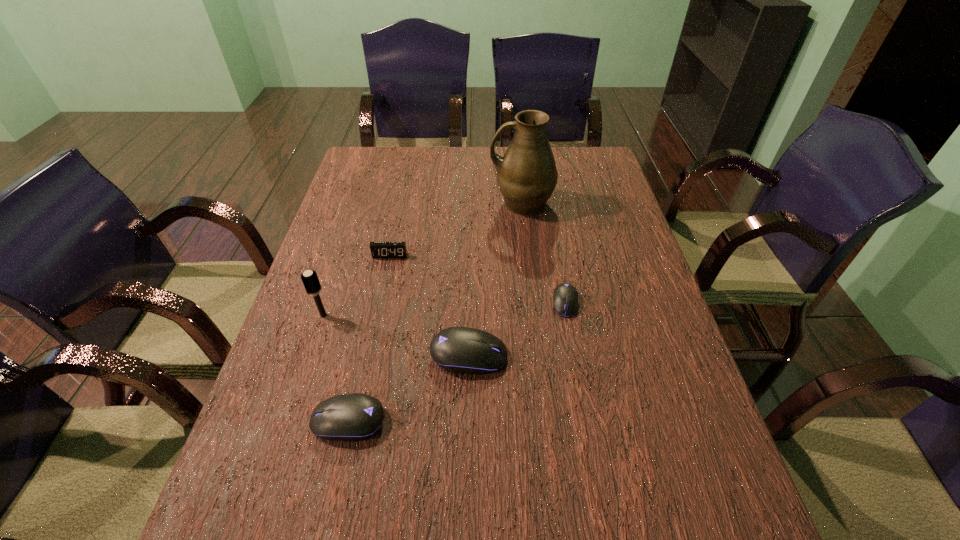
Image resolution: width=960 pixels, height=540 pixels. In order to click on blank region between the hairbrush and the nearest computer mouse in this screenshot , I will do `click(336, 368)`.

This screenshot has height=540, width=960. I want to click on free space between the tallest object and the hairbrush, so click(422, 260).

You are a GUI agent. You are given a task and a screenshot of the screen. Output one action in this format:
    pyautogui.click(x=<x>, y=<y>)
    Task: Click on the blank region between the farthest computer mouse and the second computer mouse from left to right
    
    Given the screenshot: What is the action you would take?
    pyautogui.click(x=517, y=329)

Locate an element on the screen. The image size is (960, 540). vacant area between the rightmost computer mouse and the second tallest object is located at coordinates (444, 309).

Find the location of a particular element. This screenshot has height=540, width=960. vacant space in between the second computer mouse from left to right and the second shortest computer mouse is located at coordinates (409, 388).

Image resolution: width=960 pixels, height=540 pixels. Identify the location of vacant space that's between the fifth shortest object and the second shortest computer mouse. tap(336, 368).

Find the location of `free area in between the shortest computer mouse and the fifth shortest object`. free area in between the shortest computer mouse and the fifth shortest object is located at coordinates (444, 309).

This screenshot has width=960, height=540. I want to click on vacant point located between the second tallest computer mouse and the tallest object, so click(435, 313).

Select which object is the second closest to the second tallest computer mouse. Please provide its 2D coordinates. Your answer should be formatted as a tuple, i.e. [(x, y)], where the tuple contains the x and y coordinates of a point satisfying the conditions above.

[(309, 278)]

Locate which object ranks in proximity to the second computer mouse from right to left. Please provide its 2D coordinates. Your answer should be formatted as a tuple, i.e. [(x, y)], where the tuple contains the x and y coordinates of a point satisfying the conditions above.

[(351, 417)]